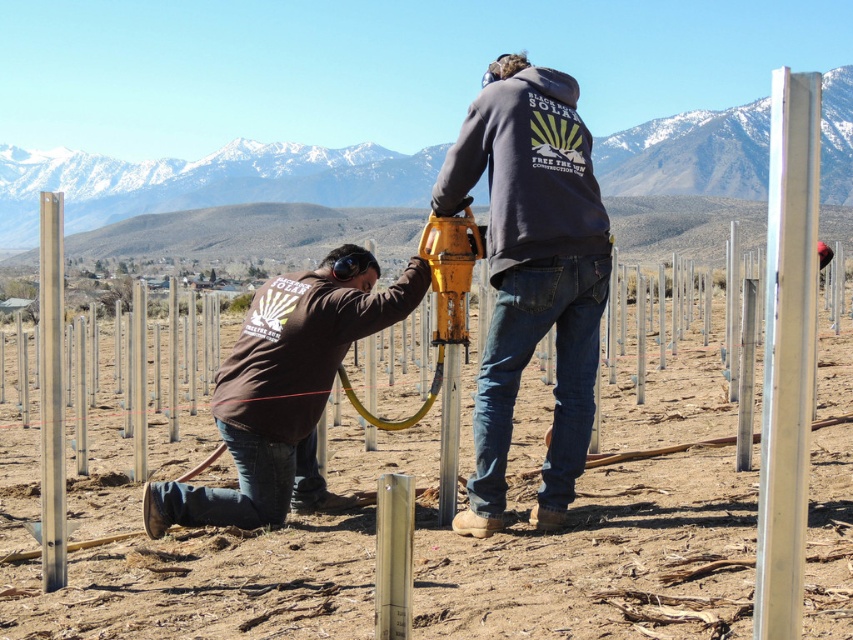
You are a construction worker who needs to place a new pole exactly where the brown dirt field at center is currently located. However, there is already a polished silver pole at right in that area. Can you still install the new pole at the desired location?

The brown dirt field at center is positioned on the left side of the polished silver pole at right, meaning the desired location for the new pole is already occupied by the polished silver pole at right. Therefore, you cannot install the new pole there without relocating the existing one.

What is located at the coordinates point (421, 538) in the image?

The coordinates point (421, 538) indicate the location of the brown dirt field at center.